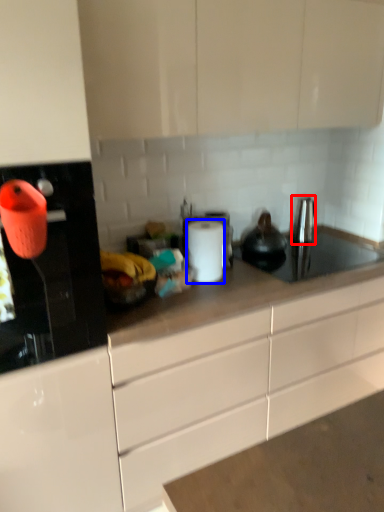
Question: Which object is further to the camera taking this photo, faucet (highlighted by a red box) or paper towel (highlighted by a blue box)?

Choices:
 (A) faucet
 (B) paper towel

Answer: (A)